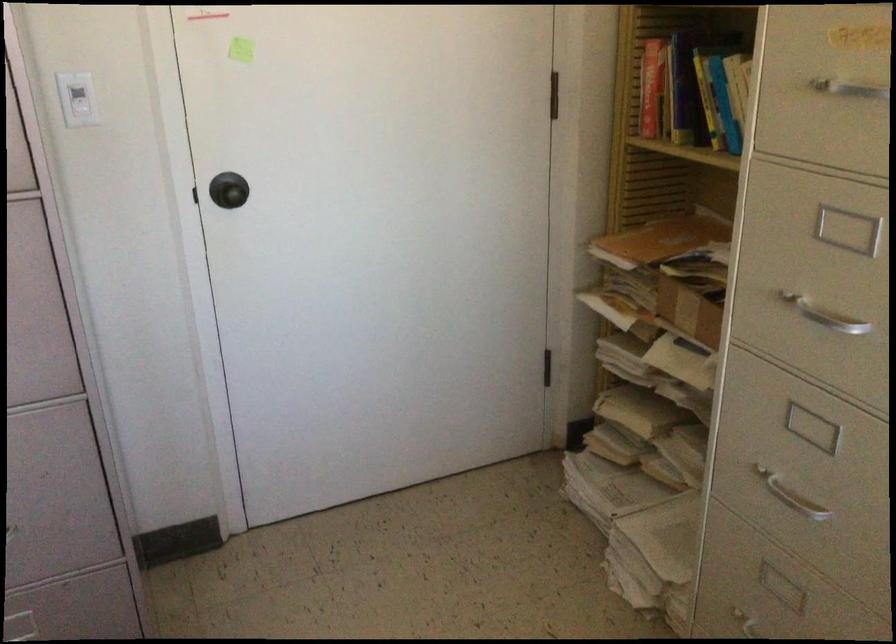
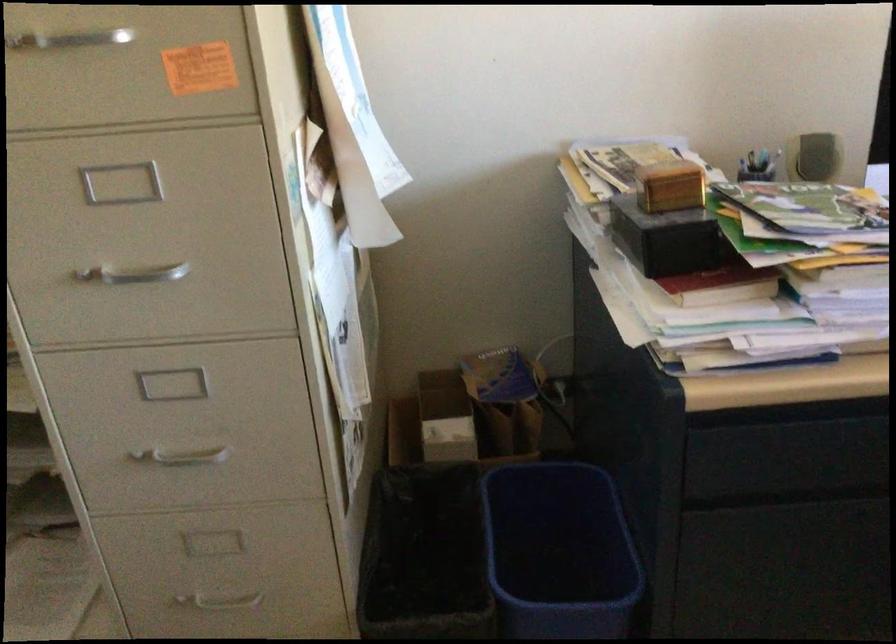
The point at (782, 496) is marked in the first image. Where is the corresponding point in the second image?

(181, 456)